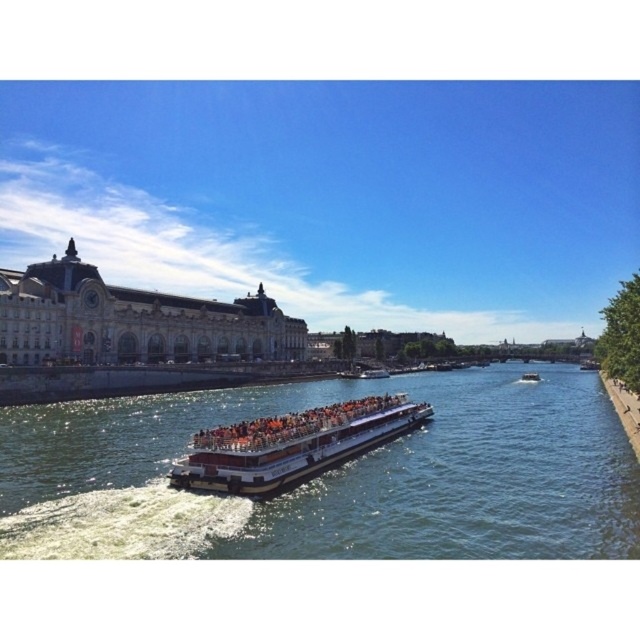
Question: Which point is farther to the camera?

Choices:
 (A) greenish-blue water at center
 (B) metallic silver boat at center
 (C) white plastic boat at center
 (D) white glossy boat at center

Answer: (C)

Question: Is greenish-blue water at center closer to the viewer compared to white glossy boat at center?

Choices:
 (A) yes
 (B) no

Answer: (A)

Question: Observing the image, what is the correct spatial positioning of white glossy boat at center in reference to white plastic boat at center?

Choices:
 (A) above
 (B) below

Answer: (A)

Question: Is white glossy boat at center positioned at the back of metallic silver boat at center?

Choices:
 (A) no
 (B) yes

Answer: (A)

Question: Which object appears farthest from the camera in this image?

Choices:
 (A) metallic silver boat at center
 (B) white plastic boat at center
 (C) white glossy boat at center
 (D) greenish-blue water at center

Answer: (B)

Question: Which object is positioned closest to the white plastic boat at center?

Choices:
 (A) white glossy boat at center
 (B) greenish-blue water at center

Answer: (B)